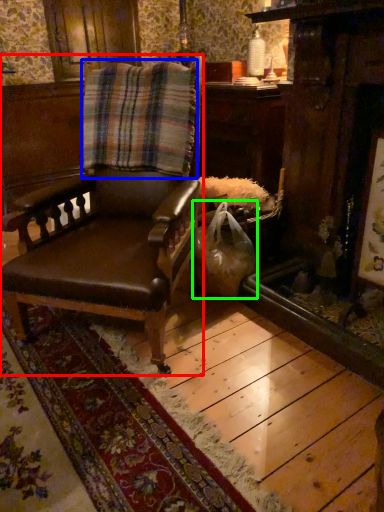
Question: Which is nearer to the chair (highlighted by a red box)? blanket (highlighted by a blue box) or shopping bag (highlighted by a green box).

Choices:
 (A) blanket
 (B) shopping bag

Answer: (A)